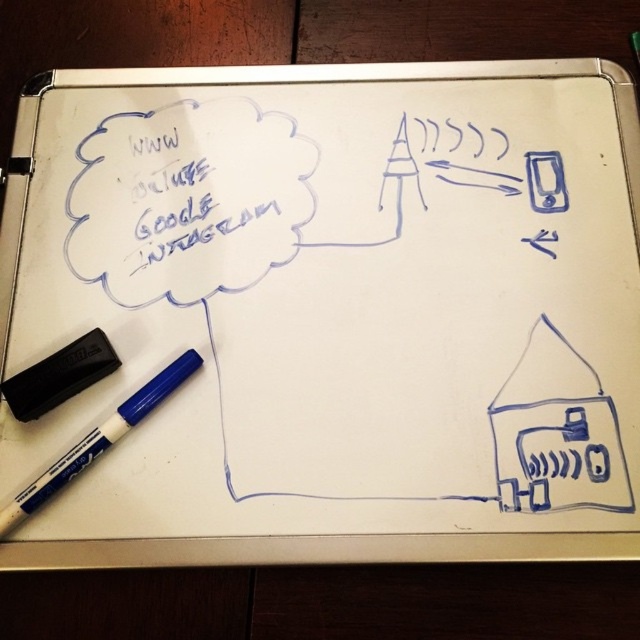
You are standing in front of the whiteboard and want to touch both points. Which point should you reach for first, point [227,163] or point [77,456]?

You should reach for point [227,163] first because it is closer to you than point [77,456], which is further away.

You are an office worker who needs to write a note on the whiteboard. You see the blue handwritten text at upper left and the white matte marker at bottom left. Which object is smaller in size?

The blue handwritten text at upper left is smaller in size compared to the white matte marker at bottom left.

You are standing 30 inches away from the whiteboard. Can you comfortably read the blue handwritten text at upper left without moving closer?

The blue handwritten text at upper left is 32.19 inches away from the viewer. Since you are standing 30 inches away, you are closer than the text, so yes, you can comfortably read it without moving closer.